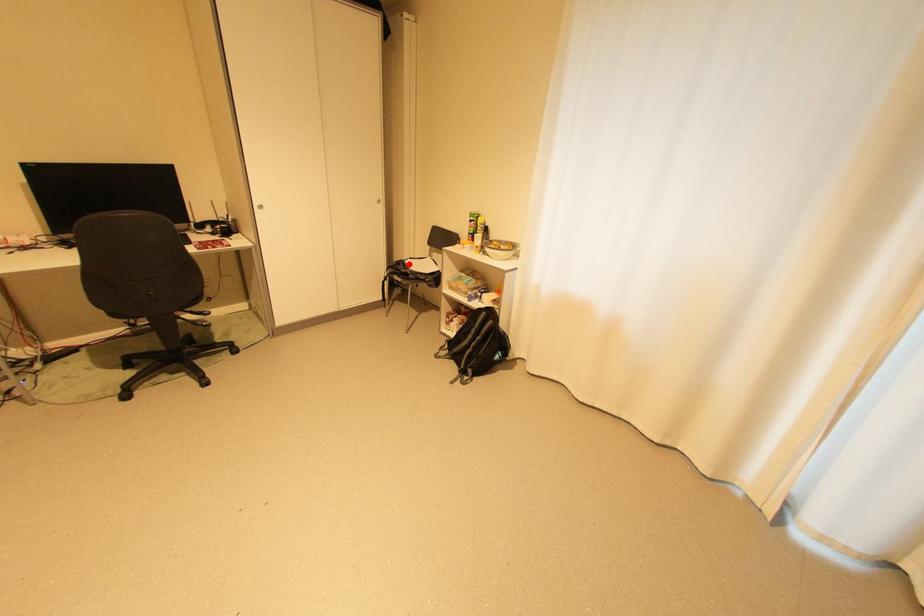
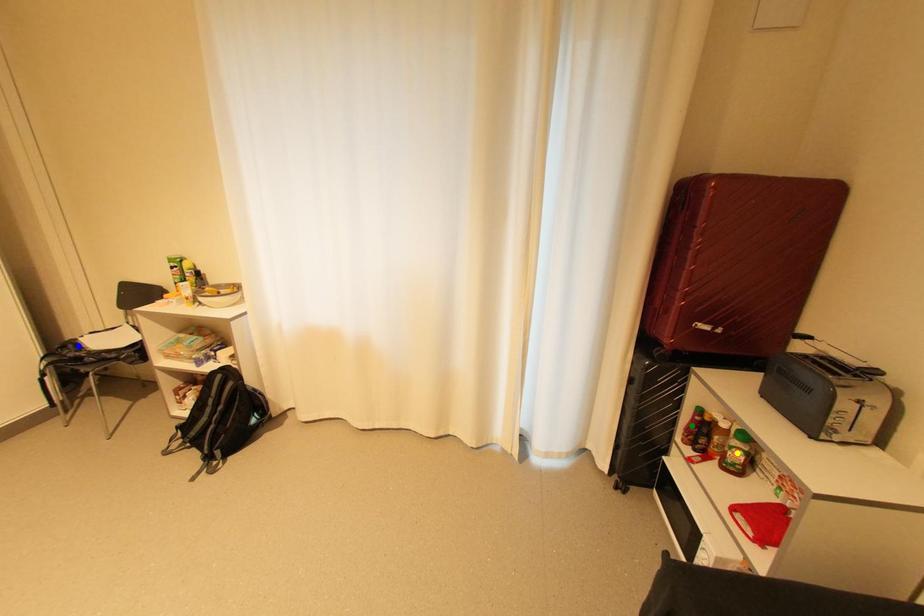
Question: I am providing you with two images of the same scene from different viewpoints. A red point is marked on the first image. You are given multiple points on the second image. Which point in image 2 represents the same 3d spot as the red point in image 1?

Choices:
 (A) green point
 (B) yellow point
 (C) blue point

Answer: (C)